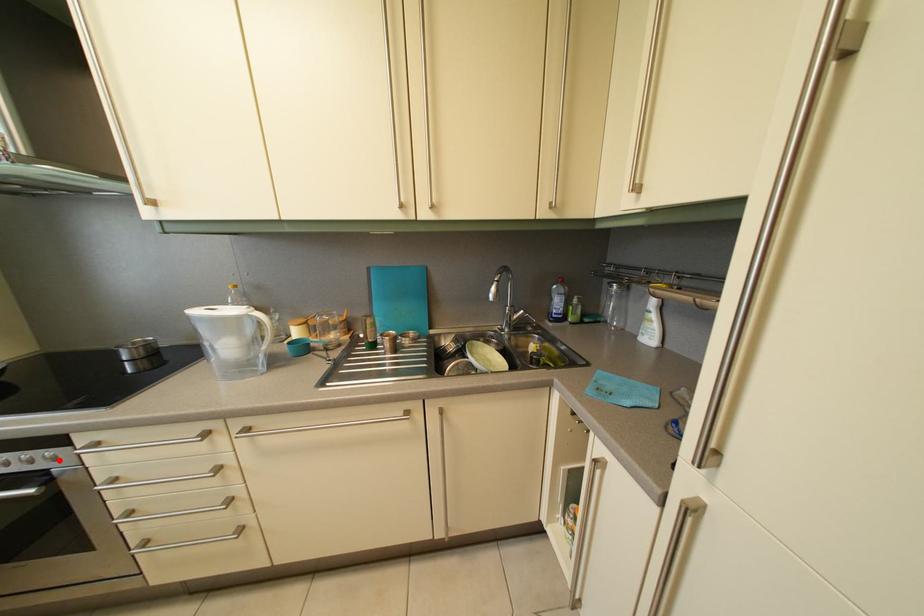
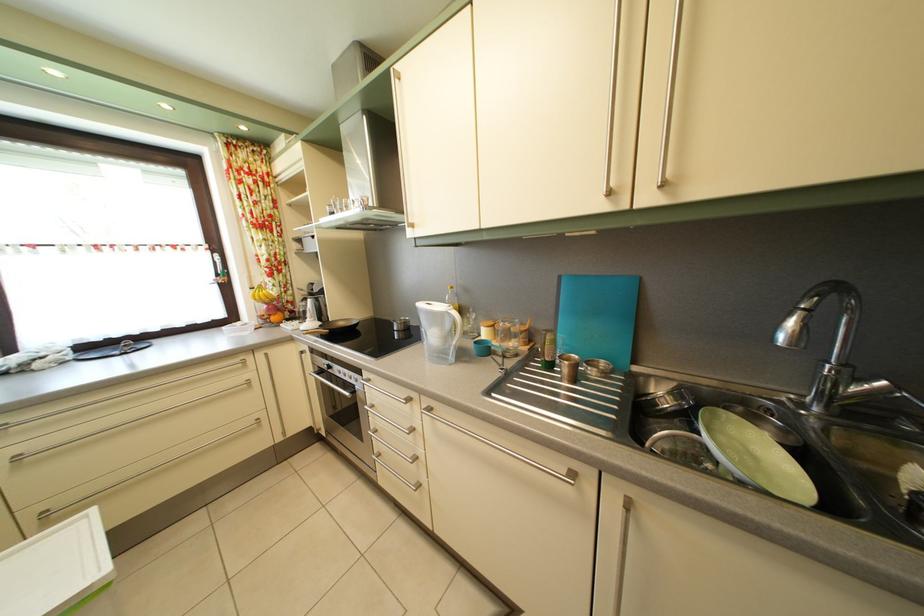
Find the pixel in the second image that matches the highlighted location in the first image.

(365, 384)